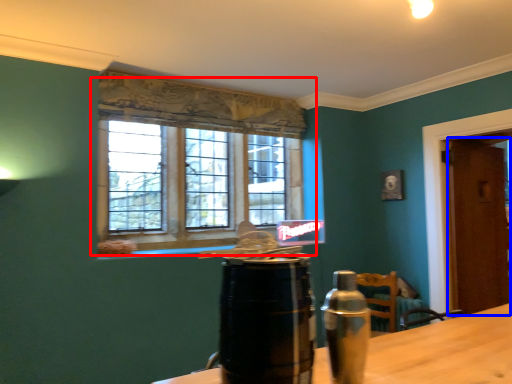
Question: Which of the following is the closest to the observer, window (highlighted by a red box) or door (highlighted by a blue box)?

Choices:
 (A) window
 (B) door

Answer: (A)